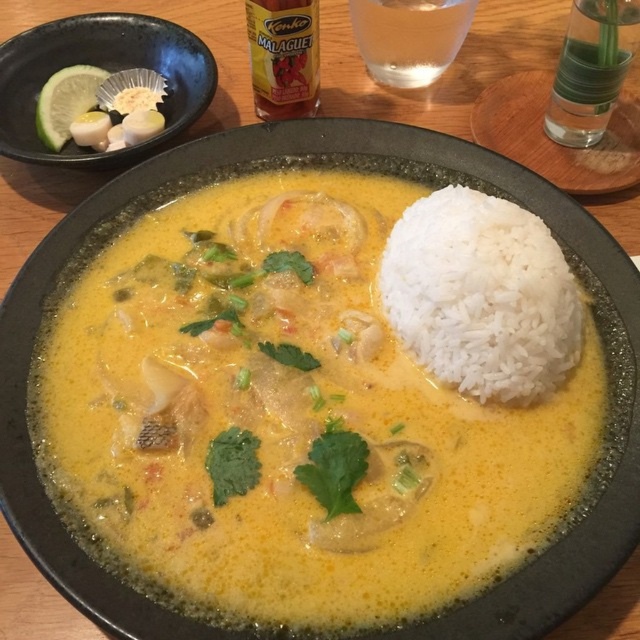
You are a food photographer setting up a shot of the dish. You want to highlight both the white polished rice at upper right and the green matte lime at upper left. Based on their positions, which object should you adjust to ensure both are in the frame?

The white polished rice at upper right is below the green matte lime at upper left. To ensure both are in the frame, you should adjust the position of the white polished rice at upper right upwards or move the green matte lime at upper left downwards so they are within the camera frame.

You are a chef preparing a dish and need to place the white polished rice at upper right and the green matte lime at upper left on a plate. The minimum distance required between these items is 24 inches for presentation purposes. Based on the image, will the current placement meet this requirement?

The white polished rice at upper right is 26.37 inches away from the green matte lime at upper left, which exceeds the minimum 24 inches requirement. Therefore, the current placement meets the presentation requirement.

You are a food delivery person who needs to place a hot pad between the white polished rice at upper right and the black ceramic bowl at upper left. The hot pad is 10 inches wide. Can you fit the hot pad between them?

The distance between the white polished rice at upper right and the black ceramic bowl at upper left is 20.16 inches. Since the hot pad is only 10 inches wide, there is enough space to place it between them.